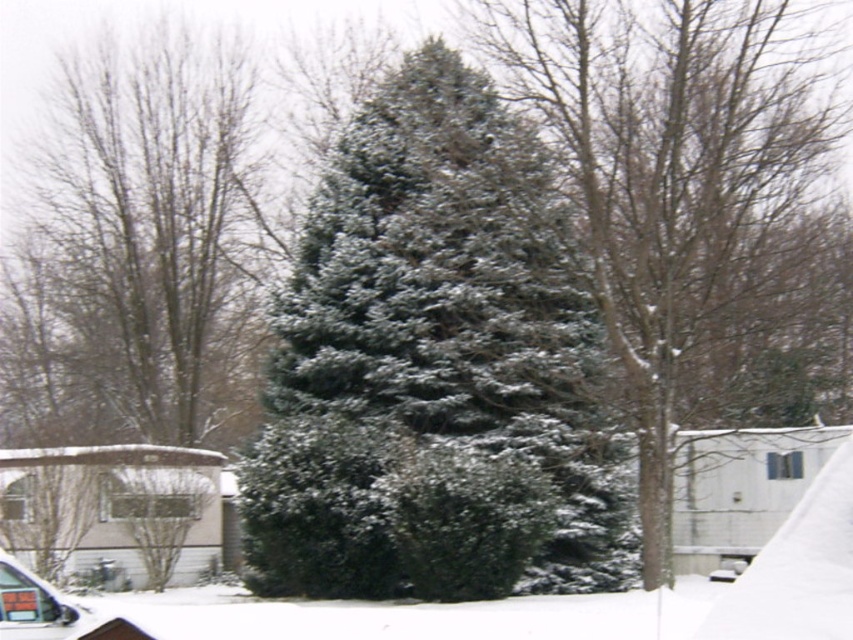
You are standing at the point marked as point (457,307) in the winter scene. What object is exactly at that point?

The green matte fir tree at center is exactly at point (457,307).

You are standing in the winter scene and want to walk from the mobile home to the large evergreen tree. Which direction should you head to first? The path is marked by two points, point A at coordinates point A is point (456, 224) and point B at point (688, 80). Since you need to follow the path closer to you first before moving further away, which point should you start at?

You should start at point A at coordinates point (456, 224) because it is closer to the viewer than point B at point (688, 80).

You are standing at the point with coordinates point (53, 209) and want to walk to the point with coordinates point (521, 68). Which direction should you face to walk towards your destination?

You should face north to walk towards point (521, 68) from point (53, 209).